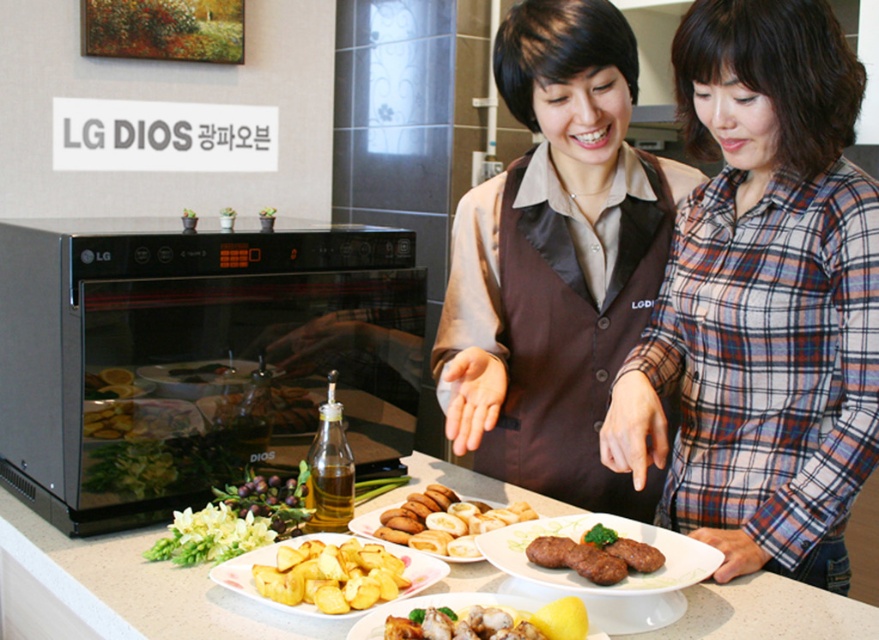
Between golden crispy potato at center and golden brown dough at center, which one is positioned lower?

Positioned lower is golden crispy potato at center.

Is point (325, 612) positioned before point (410, 531)?

Yes.

Locate an element on the screen. The height and width of the screenshot is (640, 879). golden crispy potato at center is located at coordinates (331, 576).

Between point (282, 592) and point (465, 595), which one is positioned in front?

Positioned in front is point (282, 592).

Does golden crispy potato at center come behind matte brown plate at center?

Yes, it is behind matte brown plate at center.

This screenshot has width=879, height=640. What are the coordinates of `golden crispy potato at center` in the screenshot? It's located at (331, 576).

Can you confirm if brown fabric vest at center is bigger than white glossy plate at center?

Indeed, brown fabric vest at center has a larger size compared to white glossy plate at center.

The height and width of the screenshot is (640, 879). I want to click on brown fabric vest at center, so click(761, 300).